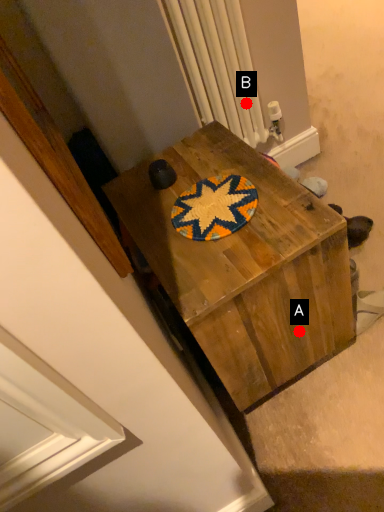
Question: Two points are circled on the image, labeled by A and B beside each circle. Which point is farther from the camera taking this photo?

Choices:
 (A) A is further
 (B) B is further

Answer: (B)